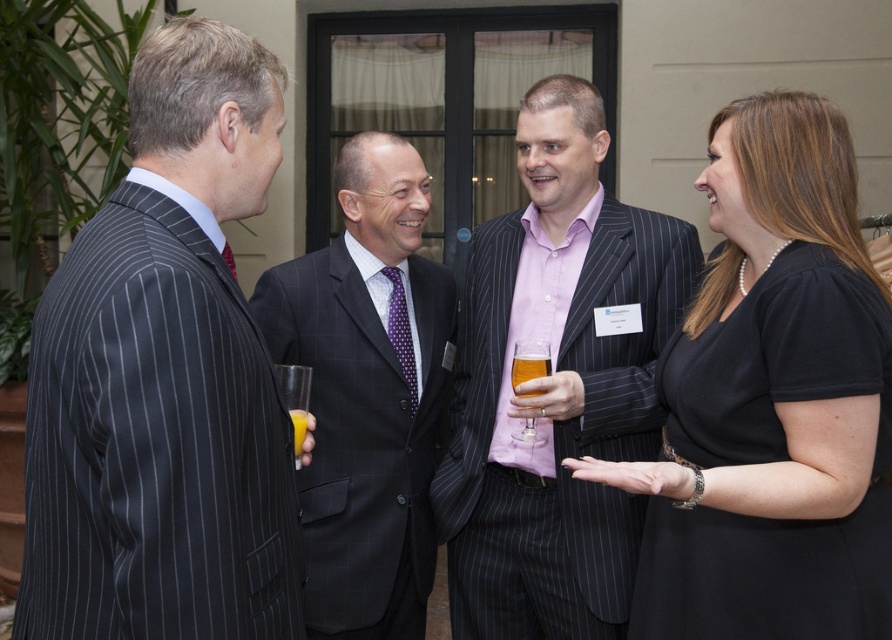
Can you confirm if black matte dress at center is taller than pink striped suit at center?

In fact, black matte dress at center may be shorter than pink striped suit at center.

Which is more to the right, black matte dress at center or pink striped suit at center?

Positioned to the right is black matte dress at center.

The height and width of the screenshot is (640, 892). Identify the location of black matte dress at center. (772, 401).

Who is lower down, translucent glass at center or translucent glass orange juice at lower left?

translucent glass orange juice at lower left

Does translucent glass at center appear on the left side of translucent glass orange juice at lower left?

Incorrect, translucent glass at center is not on the left side of translucent glass orange juice at lower left.

Describe the element at coordinates (529, 365) in the screenshot. This screenshot has width=892, height=640. I see `translucent glass at center` at that location.

The image size is (892, 640). Identify the location of translucent glass at center. (529, 365).

Which of these two, dark gray pinstripe suit at left or translucent glass orange juice at lower left, stands taller?

dark gray pinstripe suit at left is taller.

Is point (192, 154) closer to viewer compared to point (298, 452)?

Yes, point (192, 154) is in front of point (298, 452).

I want to click on dark gray pinstripe suit at left, so click(164, 378).